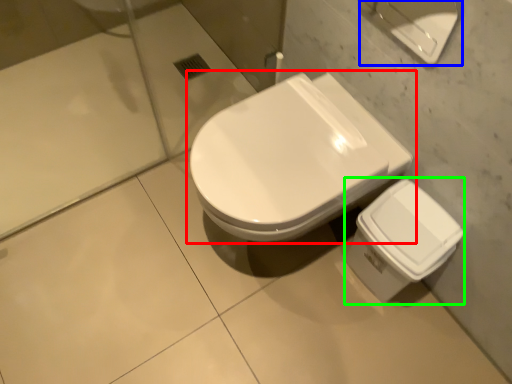
Question: Based on their relative distances, which object is nearer to toilet (highlighted by a red box)? Choose from porcelain (highlighted by a blue box) and porcelain (highlighted by a green box).

Choices:
 (A) porcelain
 (B) porcelain

Answer: (B)